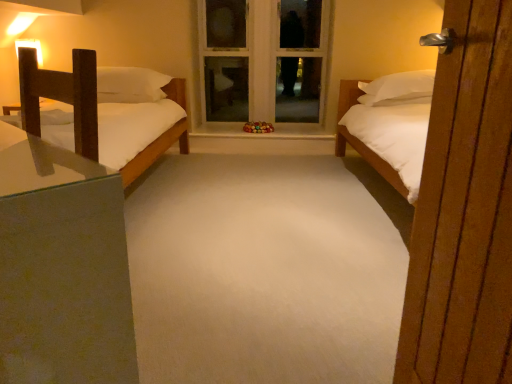
Locate an element on the screen. The height and width of the screenshot is (384, 512). free space above white soft carpet at center (from a real-world perspective) is located at coordinates (243, 213).